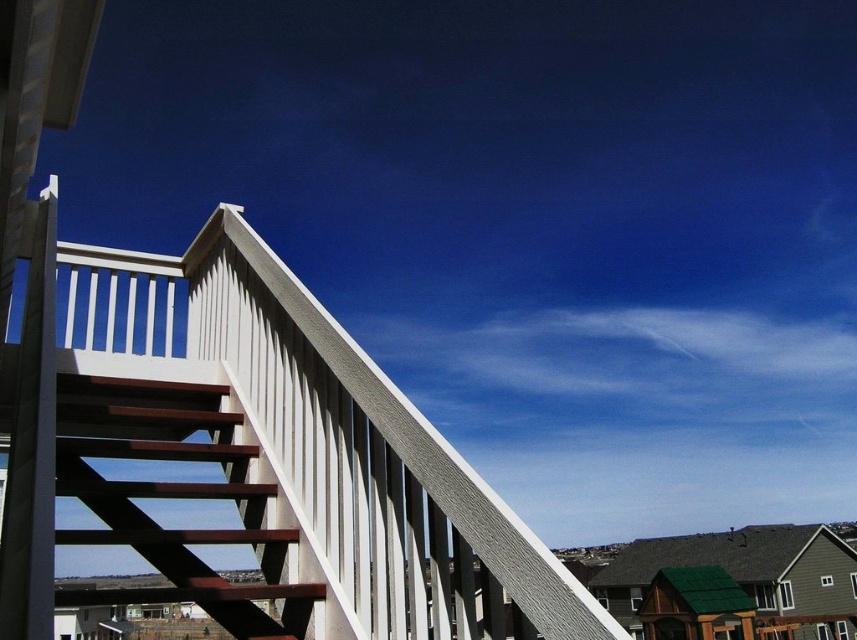
Question: Does white textured porch at upper left have a lesser width compared to brown wooden stairs at upper left?

Choices:
 (A) yes
 (B) no

Answer: (B)

Question: Does white textured porch at upper left have a lesser width compared to brown wooden stairs at upper left?

Choices:
 (A) no
 (B) yes

Answer: (A)

Question: Among these objects, which one is farthest from the camera?

Choices:
 (A) white textured porch at upper left
 (B) brown wooden stairs at upper left

Answer: (B)

Question: Which object appears farthest from the camera in this image?

Choices:
 (A) white textured porch at upper left
 (B) brown wooden stairs at upper left

Answer: (B)

Question: Does white textured porch at upper left have a lesser width compared to brown wooden stairs at upper left?

Choices:
 (A) yes
 (B) no

Answer: (B)

Question: Which point is closer to the camera?

Choices:
 (A) white textured porch at upper left
 (B) brown wooden stairs at upper left

Answer: (A)